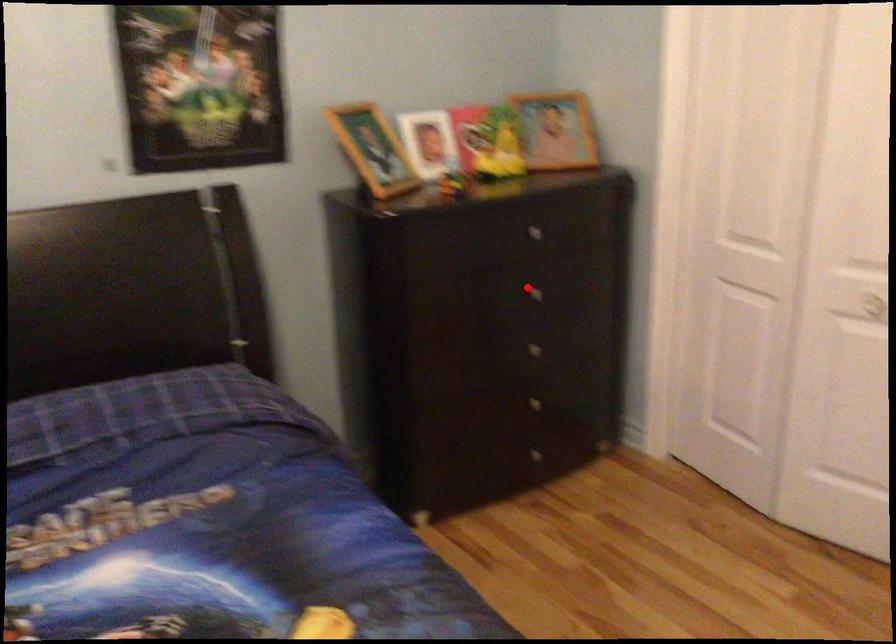
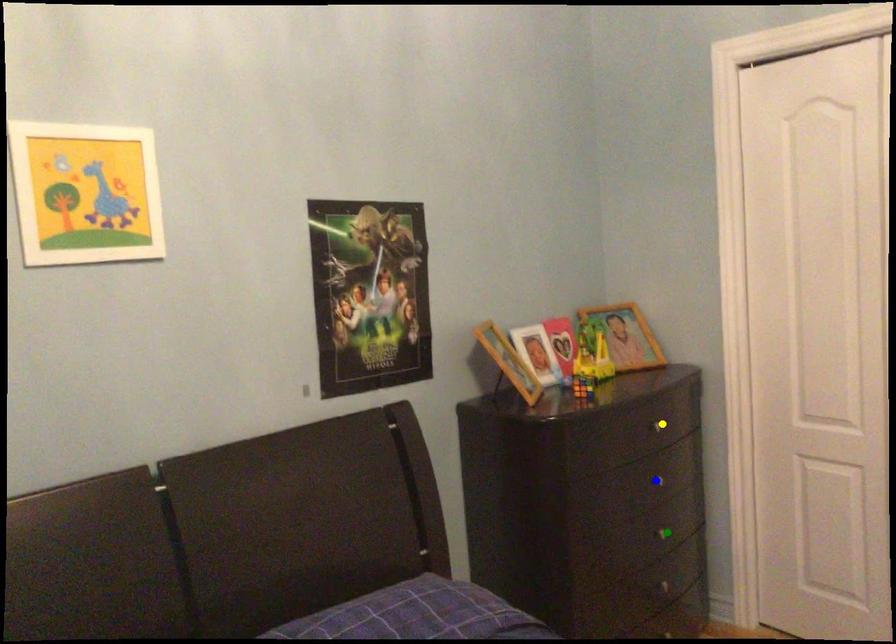
Question: I am providing you with two images of the same scene from different viewpoints. A red point is marked on the first image. You are given multiple points on the second image. Which point in image 2 is actually the same real-world point as the red point in image 1?

Choices:
 (A) yellow point
 (B) blue point
 (C) green point

Answer: (B)